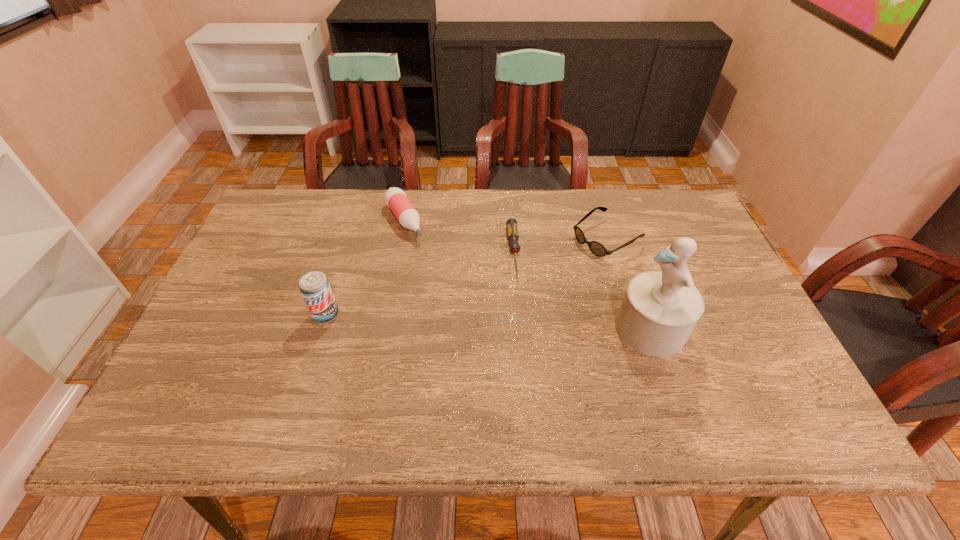
At what (x,y) coordinates should I click in order to perform the action: click on the second tallest object. Please return your answer as a coordinate pair (x, y). The image size is (960, 540). Looking at the image, I should click on (315, 288).

In order to click on beer can in this screenshot , I will do `click(315, 288)`.

In order to click on figurine in this screenshot , I will do `click(660, 308)`.

Locate an element on the screen. This screenshot has height=540, width=960. the second shortest object is located at coordinates (596, 248).

I want to click on screwdriver, so click(x=512, y=228).

This screenshot has width=960, height=540. I want to click on the third object from left to right, so click(512, 228).

Where is `the second object from left to right`? the second object from left to right is located at coordinates (395, 198).

This screenshot has height=540, width=960. What are the coordinates of `the third shortest object` in the screenshot? It's located at (395, 198).

The height and width of the screenshot is (540, 960). What are the coordinates of `free region located 0.210m on the back of the beer can` in the screenshot? It's located at (347, 249).

You are a GUI agent. You are given a task and a screenshot of the screen. Output one action in this format:
    pyautogui.click(x=<x>, y=<y>)
    Task: Click on the vacant space positioned at the beak of the tallest object
    The height and width of the screenshot is (540, 960).
    Given the screenshot: What is the action you would take?
    pyautogui.click(x=452, y=329)